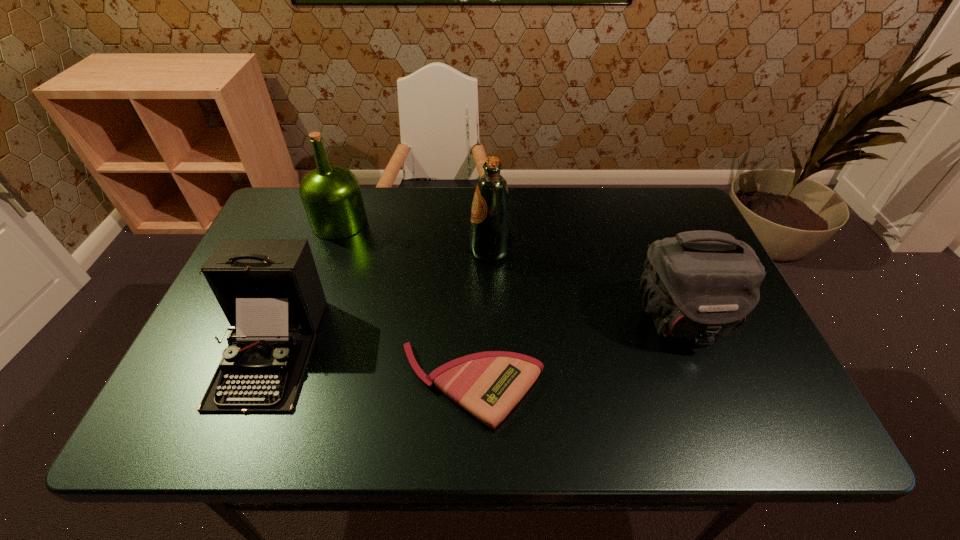
This screenshot has width=960, height=540. I want to click on vacant space located on the back of the shortest object, so click(x=474, y=234).

You are a GUI agent. You are given a task and a screenshot of the screen. Output one action in this format:
    pyautogui.click(x=<x>, y=<y>)
    Task: Click on the typewriter that is at the near edge
    This screenshot has width=960, height=540.
    Given the screenshot: What is the action you would take?
    pyautogui.click(x=269, y=289)

The width and height of the screenshot is (960, 540). What are the coordinates of `wristlet present at the near edge` in the screenshot? It's located at (488, 385).

This screenshot has width=960, height=540. Find the location of `olive oil present at the left edge`. olive oil present at the left edge is located at coordinates click(x=331, y=196).

Identify the location of typewriter situated at the left edge. The width and height of the screenshot is (960, 540). (269, 289).

You are a GUI agent. You are given a task and a screenshot of the screen. Output one action in this format:
    pyautogui.click(x=<x>, y=<y>)
    Task: Click on the object that is at the right edge
    
    Given the screenshot: What is the action you would take?
    pyautogui.click(x=700, y=285)

Where is `object that is at the far left corner`? Image resolution: width=960 pixels, height=540 pixels. object that is at the far left corner is located at coordinates (331, 196).

Find the location of `object at the near left corner`. object at the near left corner is located at coordinates (269, 289).

In the image, there is a desktop. Find the location of `free space at the far edge`. free space at the far edge is located at coordinates tap(399, 197).

You are a GUI agent. You are given a task and a screenshot of the screen. Output one action in this format:
    pyautogui.click(x=<x>, y=<y>)
    Task: Click on the vacant space at the near edge
    
    Given the screenshot: What is the action you would take?
    pyautogui.click(x=489, y=431)